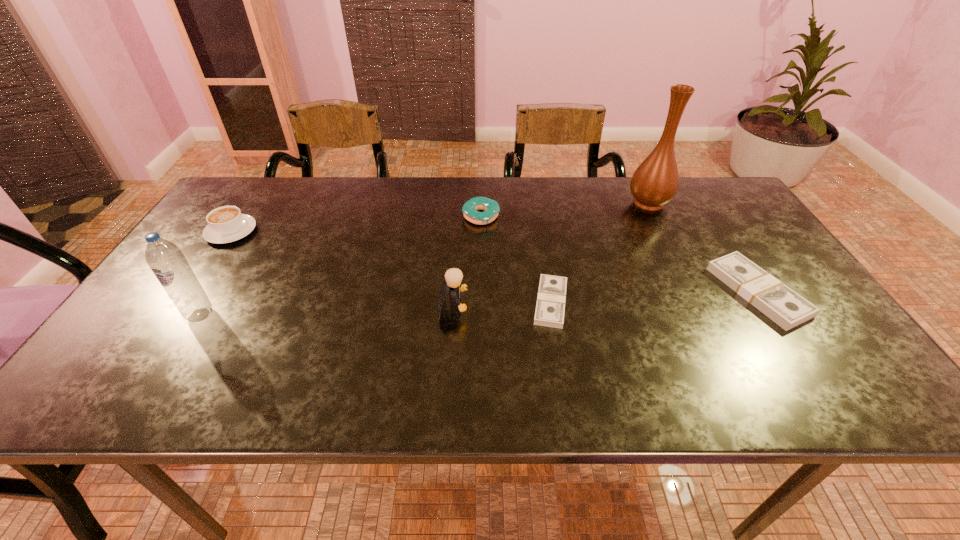
Image resolution: width=960 pixels, height=540 pixels. I want to click on free space for a new dollar on the left, so click(333, 313).